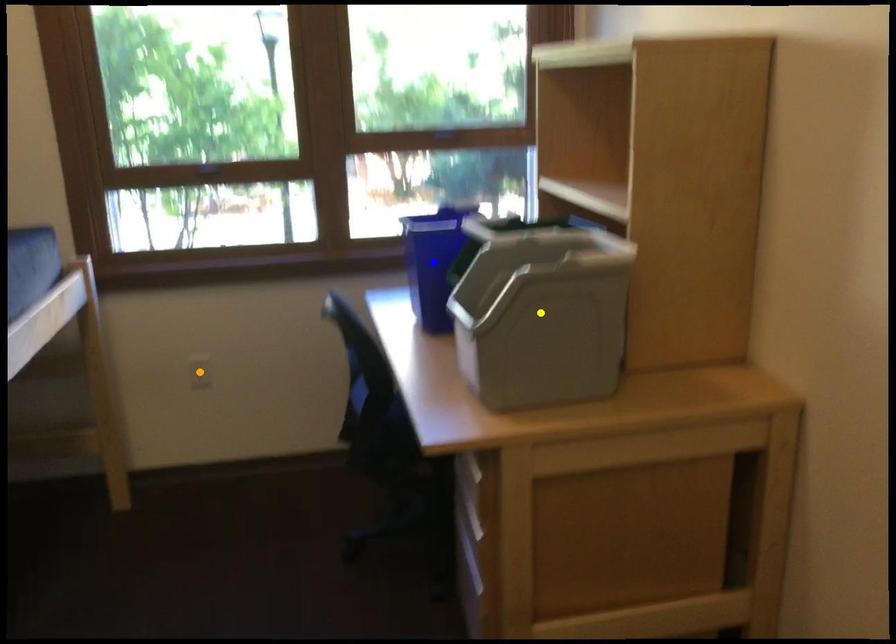
Order these from nearest to farthest:
1. blue point
2. yellow point
3. orange point

yellow point → blue point → orange point